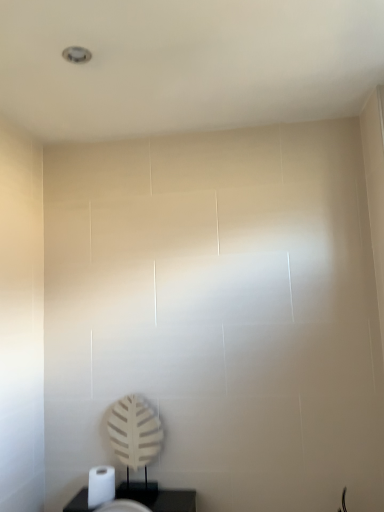
The image size is (384, 512). What do you see at coordinates (101, 485) in the screenshot? I see `white matte toilet paper at lower left` at bounding box center [101, 485].

Image resolution: width=384 pixels, height=512 pixels. In order to click on white matte toilet paper at lower left in this screenshot , I will do `click(101, 485)`.

In order to click on white matte toilet paper at lower left in this screenshot , I will do click(101, 485).